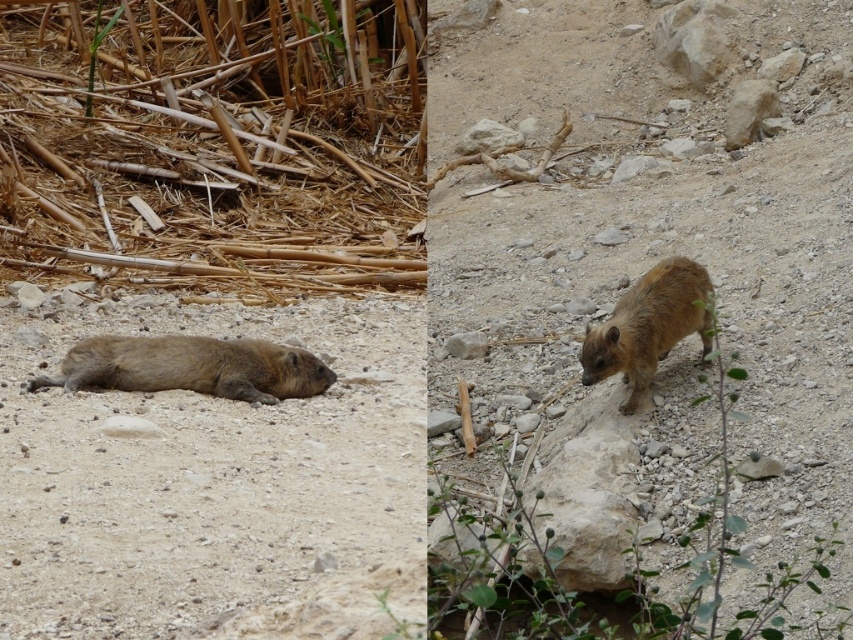
You are standing in front of a diptych displaying two photographs. The left image shows a hyrax lying on sandy ground with dry bamboo around it, while the right image has a hyrax sniffing on rocky terrain. There is a specific point marked at coordinates point (x=270, y=346). Can you determine the distance of this point from you?

The distance of point (x=270, y=346) from viewer is 6.06 meters.

You are a wildlife researcher observing two hyraxes in their habitat. You notice the brown furry hyrax at lower left and the brown furry hyrax at center. Which one is positioned more to the left in the image?

The brown furry hyrax at lower left is positioned more to the left in the image.

You are a wildlife researcher observing two hyraxes in their habitat. You notice the brown furry hyrax at lower left and the brown furry hyrax at center. Which one is more likely to be a juvenile based on their size?

The brown furry hyrax at lower left is smaller than the brown furry hyrax at center, so it is more likely to be a juvenile.